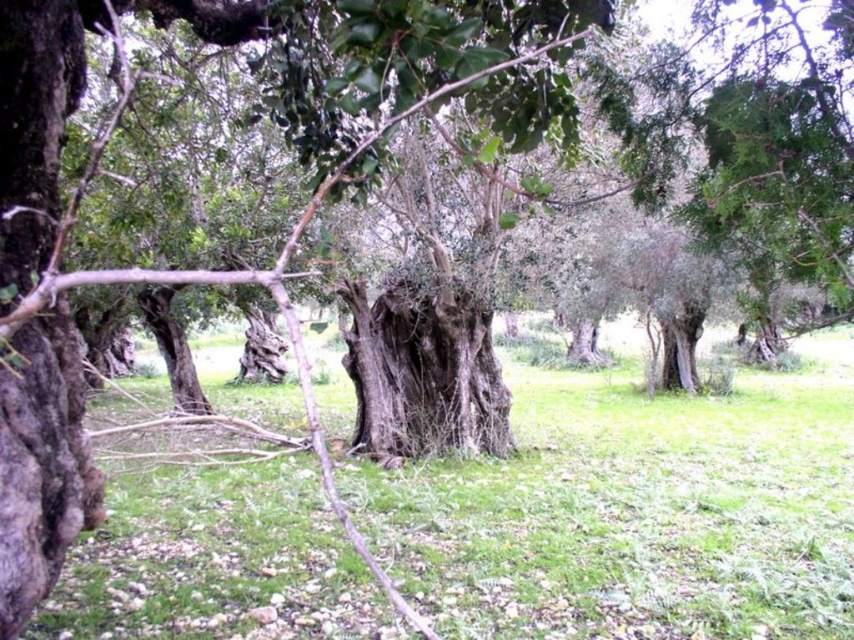
You are standing in the grove of ancient olive trees and notice a specific point marked at coordinates (635, 509). According to the scene description, what is located at that point?

The point at coordinates (635, 509) marks green grass at center.

You are a gardener planning to mow the green grass at center and the rough bark tree trunk at center. Which area requires a larger mower to handle its size?

The green grass at center requires a larger mower because it has a larger size compared to the rough bark tree trunk at center.

You are standing in the grove and want to step from the dark brown rough bark at left to the green grass at center. Which direction should you move?

You should move to the right to reach the green grass at center from the dark brown rough bark at left since the green grass at center is located to the right of the dark brown rough bark at left.